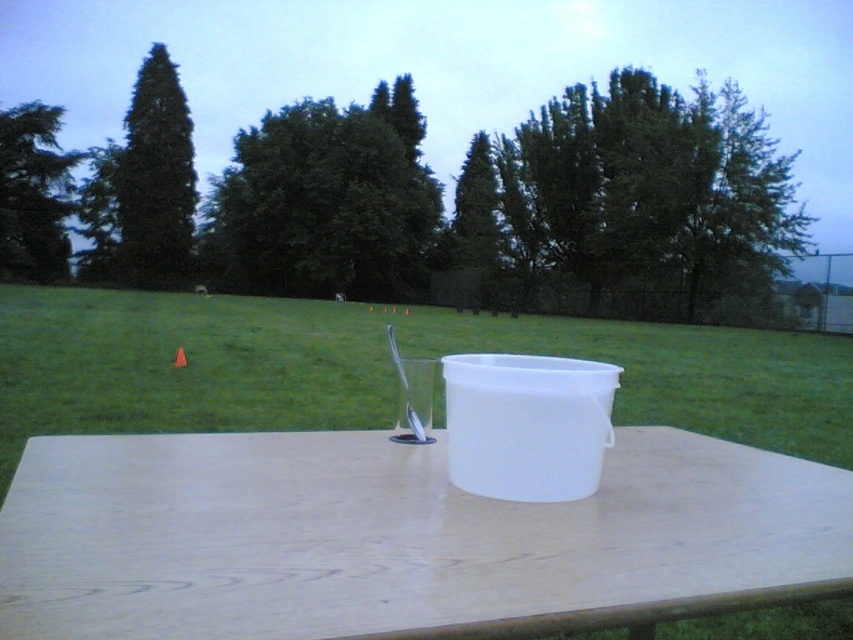
Question: Is white wood table at center wider than white plastic bucket at center?

Choices:
 (A) yes
 (B) no

Answer: (A)

Question: Does white wood table at center appear on the right side of green grass at center?

Choices:
 (A) no
 (B) yes

Answer: (A)

Question: Which point is closer to the camera?

Choices:
 (A) (608, 392)
 (B) (811, 394)
 (C) (390, 593)

Answer: (C)

Question: Among these points, which one is farthest from the camera?

Choices:
 (A) (288, 520)
 (B) (119, 426)

Answer: (B)

Question: Where is white wood table at center located in relation to green grass at center in the image?

Choices:
 (A) below
 (B) above

Answer: (A)

Question: Among these objects, which one is nearest to the camera?

Choices:
 (A) white wood table at center
 (B) green grass at center
 (C) white plastic bucket at center

Answer: (A)